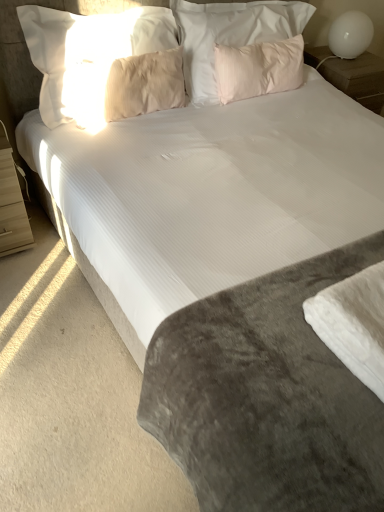
Question: Is white glossy table lamp at upper right surrounding white glossy nightstand at upper right, the 2th nightstand from the left?

Choices:
 (A) no
 (B) yes

Answer: (A)

Question: Can you confirm if white glossy table lamp at upper right is bigger than white glossy nightstand at upper right, the 2th nightstand from the left?

Choices:
 (A) yes
 (B) no

Answer: (B)

Question: Does white glossy table lamp at upper right lie behind white glossy nightstand at upper right, acting as the first nightstand starting from the back?

Choices:
 (A) no
 (B) yes

Answer: (A)

Question: Are white glossy table lamp at upper right and white glossy nightstand at upper right, which is the 1th nightstand in right-to-left order, beside each other?

Choices:
 (A) yes
 (B) no

Answer: (B)

Question: Can you confirm if white glossy table lamp at upper right is thinner than white glossy nightstand at upper right, the first nightstand viewed from the top?

Choices:
 (A) yes
 (B) no

Answer: (A)

Question: From the image's perspective, is white glossy nightstand at upper right, acting as the first nightstand starting from the back, located above or below white glossy table lamp at upper right?

Choices:
 (A) above
 (B) below

Answer: (B)

Question: Does point (344, 86) appear closer or farther from the camera than point (340, 52)?

Choices:
 (A) farther
 (B) closer

Answer: (A)

Question: Considering the relative positions of white glossy nightstand at upper right, the 2th nightstand ordered from the bottom, and white glossy table lamp at upper right in the image provided, is white glossy nightstand at upper right, the 2th nightstand ordered from the bottom, to the left or to the right of white glossy table lamp at upper right?

Choices:
 (A) left
 (B) right

Answer: (B)

Question: Considering the positions of white glossy nightstand at upper right, which is the 1th nightstand in right-to-left order, and white glossy table lamp at upper right in the image, is white glossy nightstand at upper right, which is the 1th nightstand in right-to-left order, taller or shorter than white glossy table lamp at upper right?

Choices:
 (A) short
 (B) tall

Answer: (B)

Question: From the image's perspective, is pink soft pillow at upper center, marked as the third pillow in a left-to-right arrangement, positioned above or below beige soft pillow at upper left, placed as the third pillow when sorted from right to left?

Choices:
 (A) above
 (B) below

Answer: (A)

Question: In terms of height, does pink soft pillow at upper center, marked as the third pillow in a left-to-right arrangement, look taller or shorter compared to beige soft pillow at upper left, placed as the third pillow when sorted from right to left?

Choices:
 (A) short
 (B) tall

Answer: (B)

Question: Does point (289, 26) appear closer or farther from the camera than point (134, 96)?

Choices:
 (A) farther
 (B) closer

Answer: (A)

Question: From a real-world perspective, is pink soft pillow at upper center, marked as the third pillow in a left-to-right arrangement, above or below beige soft pillow at upper left, placed as the third pillow when sorted from right to left?

Choices:
 (A) below
 (B) above

Answer: (B)

Question: From the image's perspective, is white glossy table lamp at upper right located above or below light wood nightstand at left, which is the 2th nightstand in right-to-left order?

Choices:
 (A) below
 (B) above

Answer: (B)

Question: Is white glossy table lamp at upper right wider or thinner than light wood nightstand at left, which is the 2th nightstand in right-to-left order?

Choices:
 (A) thin
 (B) wide

Answer: (A)